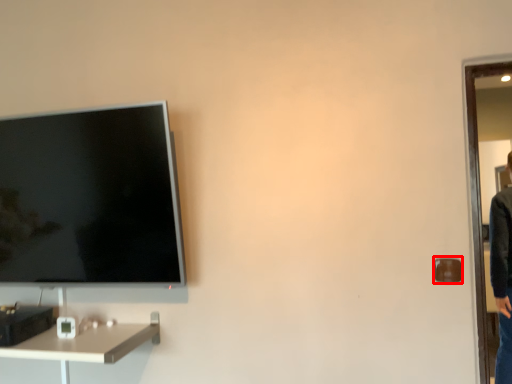
Question: In this image, where is door handle (annotated by the red box) located relative to desk?

Choices:
 (A) left
 (B) right

Answer: (B)